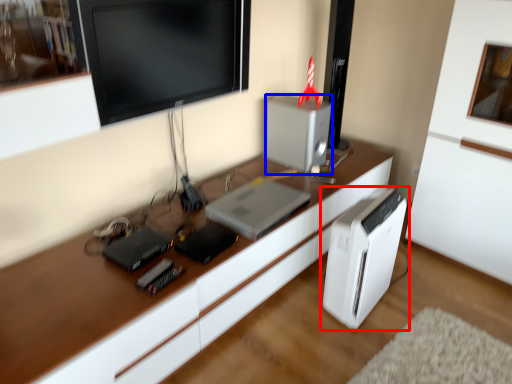
Question: Among these objects, which one is farthest to the camera, home appliance (highlighted by a red box) or appliance (highlighted by a blue box)?

Choices:
 (A) home appliance
 (B) appliance

Answer: (B)